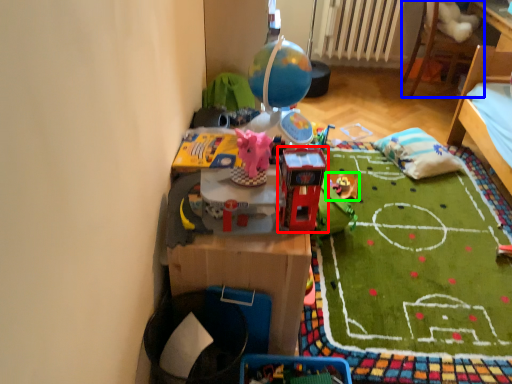
Question: Which is nearer to the toy (highlighted by a red box)? furniture (highlighted by a blue box) or toy (highlighted by a green box).

Choices:
 (A) furniture
 (B) toy

Answer: (B)